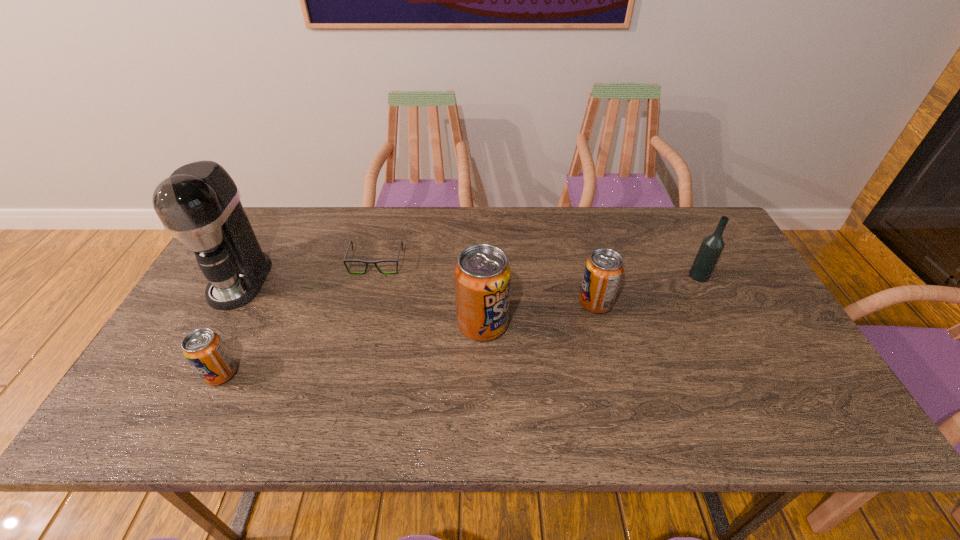
Where is `vacant space located on the right of the nearest soda can`? vacant space located on the right of the nearest soda can is located at coordinates (258, 374).

Locate an element on the screen. This screenshot has width=960, height=540. vacant area located 0.160m on the left of the second soda can from right to left is located at coordinates (396, 324).

The image size is (960, 540). In order to click on free space located 0.380m on the back of the fourth tallest object in this screenshot , I will do `click(572, 212)`.

Where is `vacant space located place cup under the spout of the tallest object`? The width and height of the screenshot is (960, 540). vacant space located place cup under the spout of the tallest object is located at coordinates (189, 373).

Locate an element on the screen. This screenshot has height=540, width=960. free space located 0.070m on the right of the rightmost object is located at coordinates (732, 275).

You are a GUI agent. You are given a task and a screenshot of the screen. Output one action in this format:
    pyautogui.click(x=<x>, y=<y>)
    Task: Click on the free space located on the lens of the shortest object
    The image size is (960, 540).
    Given the screenshot: What is the action you would take?
    [x=358, y=333]

Image resolution: width=960 pixels, height=540 pixels. In order to click on object located in the far edge section of the desktop in this screenshot , I will do `click(349, 260)`.

This screenshot has height=540, width=960. What are the coordinates of `object that is at the near edge` in the screenshot? It's located at (204, 349).

Identify the location of soda can at the left edge. (204, 349).

Image resolution: width=960 pixels, height=540 pixels. What are the coordinates of `coffee maker that is at the left edge` in the screenshot? It's located at (199, 204).